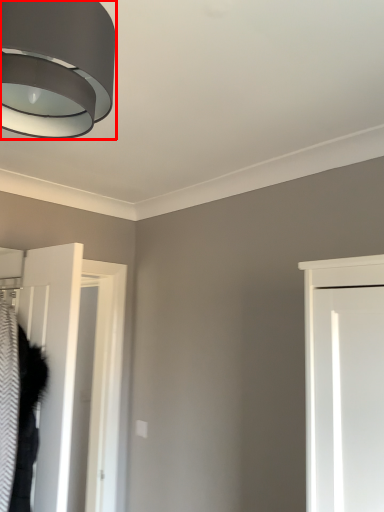
Question: In this image, where is lamp (annotated by the red box) located relative to door?

Choices:
 (A) right
 (B) left

Answer: (A)